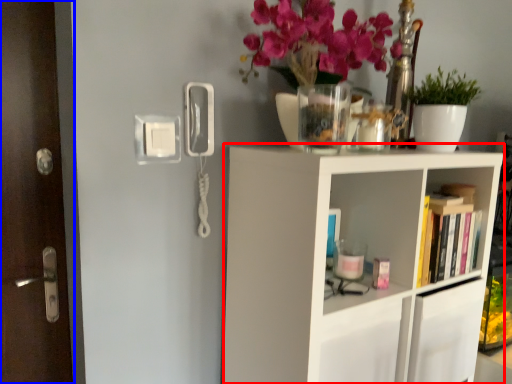
Question: Which point is further to the camera, shelf (highlighted by a red box) or door (highlighted by a blue box)?

Choices:
 (A) shelf
 (B) door

Answer: (B)